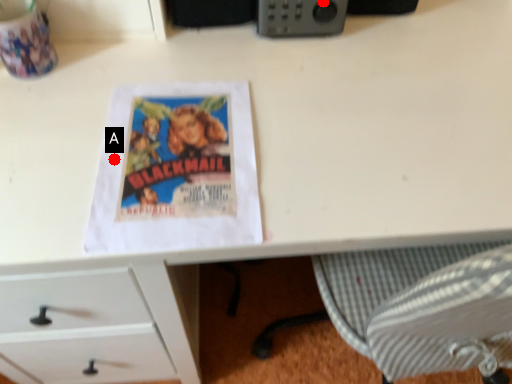
Question: Two points are circled on the image, labeled by A and B beside each circle. Among these points, which one is farthest from the camera?

Choices:
 (A) A is further
 (B) B is further

Answer: (B)